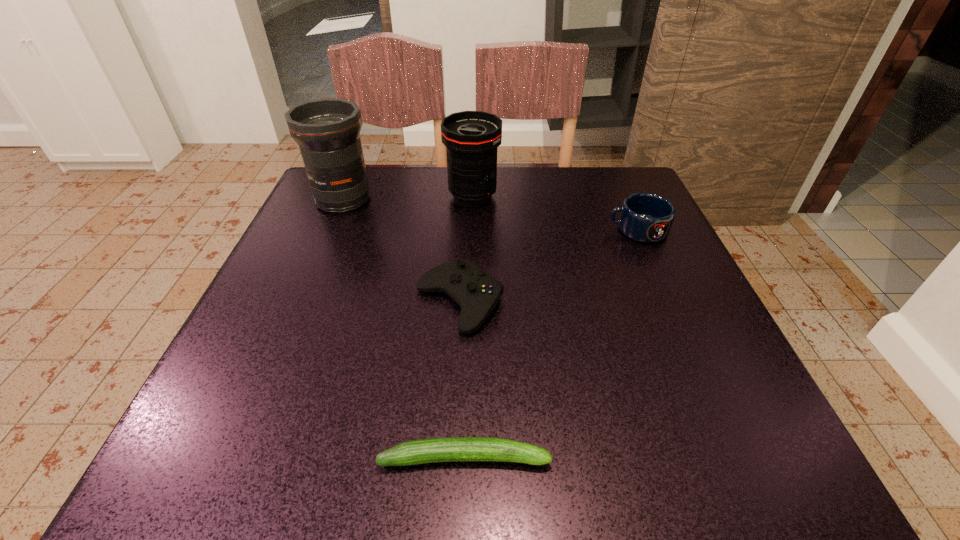
Locate an element on the screen. The height and width of the screenshot is (540, 960). free location located on the right of the fourth shortest object is located at coordinates (603, 196).

The width and height of the screenshot is (960, 540). I want to click on vacant space situated with the handle on the side of the mug, so click(x=462, y=230).

I want to click on vacant space located 0.280m with the handle on the side of the mug, so click(x=480, y=230).

What are the coordinates of `free spot located with the handle on the side of the mug` in the screenshot? It's located at (548, 230).

The image size is (960, 540). What are the coordinates of `vacant area located on the front of the control` in the screenshot? It's located at (453, 418).

You are a GUI agent. You are given a task and a screenshot of the screen. Output one action in this format:
    pyautogui.click(x=<x>, y=<y>)
    Task: Click on the blank area located on the front-facing side of the zucchini
    This screenshot has height=540, width=960.
    Given the screenshot: What is the action you would take?
    pyautogui.click(x=731, y=457)

You are a GUI agent. You are given a task and a screenshot of the screen. Output one action in this format:
    pyautogui.click(x=<x>, y=<y>)
    Task: Click on the mug at the far edge
    
    Given the screenshot: What is the action you would take?
    pyautogui.click(x=645, y=217)

The width and height of the screenshot is (960, 540). What are the coordinates of `object at the near edge` in the screenshot? It's located at [450, 449].

You are a GUI agent. You are given a task and a screenshot of the screen. Output one action in this format:
    pyautogui.click(x=<x>, y=<y>)
    Task: Click on the object that is at the left edge
    
    Given the screenshot: What is the action you would take?
    pyautogui.click(x=327, y=130)

I want to click on object that is positioned at the right edge, so click(645, 217).